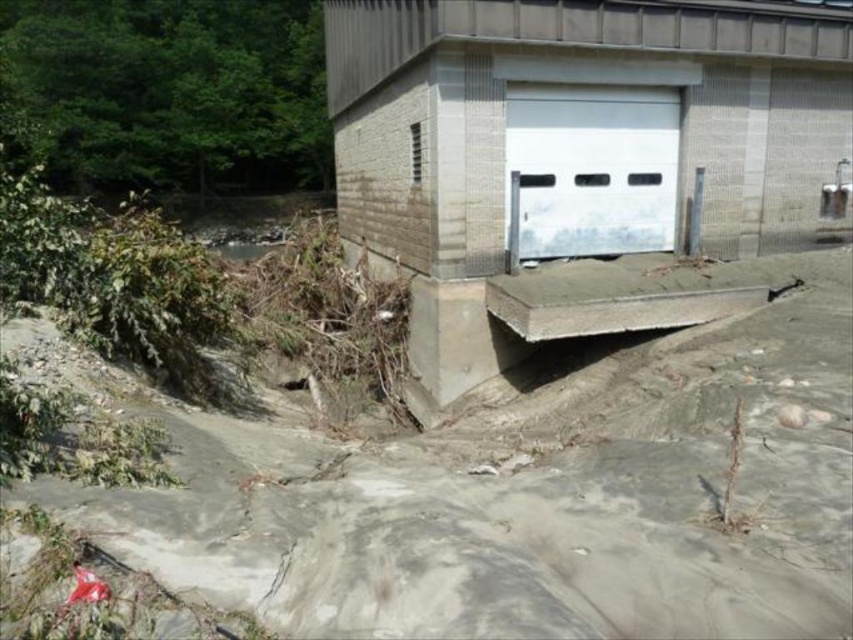
How distant is gray concrete at lower center from white matte garage door at center?

They are 10.55 meters apart.

Does gray concrete at lower center appear on the left side of white matte garage door at center?

In fact, gray concrete at lower center is to the right of white matte garage door at center.

Does point (747, 349) come in front of point (451, 333)?

Yes, point (747, 349) is in front of point (451, 333).

Where is `gray concrete at lower center`? gray concrete at lower center is located at coordinates (537, 493).

Is gray concrete at lower center to the left of white smooth garage door at center from the viewer's perspective?

Yes, gray concrete at lower center is to the left of white smooth garage door at center.

Does gray concrete at lower center appear on the right side of white smooth garage door at center?

No, gray concrete at lower center is not to the right of white smooth garage door at center.

You are a GUI agent. You are given a task and a screenshot of the screen. Output one action in this format:
    pyautogui.click(x=<x>, y=<y>)
    Task: Click on the gray concrete at lower center
    
    Given the screenshot: What is the action you would take?
    pyautogui.click(x=537, y=493)

You are a GUI agent. You are given a task and a screenshot of the screen. Output one action in this format:
    pyautogui.click(x=<x>, y=<y>)
    Task: Click on the gray concrete at lower center
    
    Given the screenshot: What is the action you would take?
    pyautogui.click(x=537, y=493)

Is white matte garage door at center in front of white smooth garage door at center?

Yes, it is in front of white smooth garage door at center.

Is white matte garage door at center bigger than white smooth garage door at center?

Correct, white matte garage door at center is larger in size than white smooth garage door at center.

Describe the element at coordinates (575, 140) in the screenshot. I see `white matte garage door at center` at that location.

Identify the location of white matte garage door at center. The height and width of the screenshot is (640, 853). (575, 140).